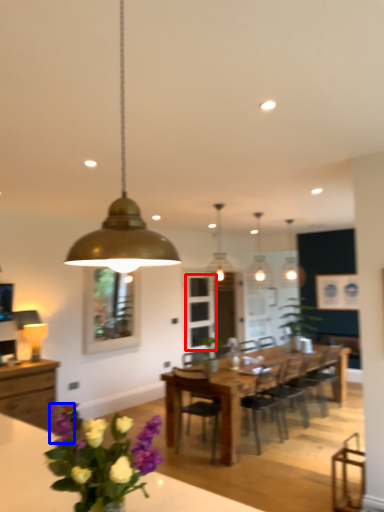
Question: Which object is further to the camera taking this photo, glass door (highlighted by a red box) or flower (highlighted by a blue box)?

Choices:
 (A) glass door
 (B) flower

Answer: (A)